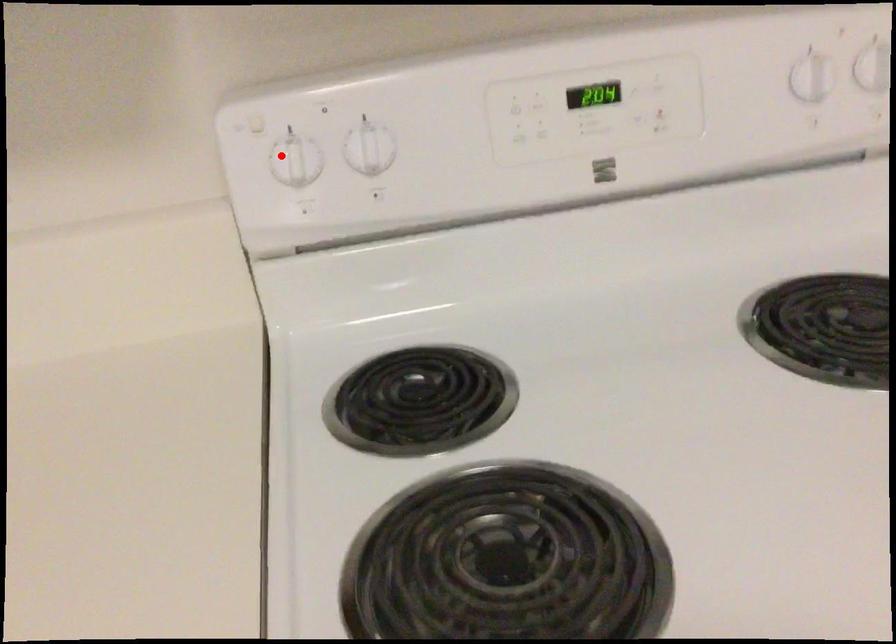
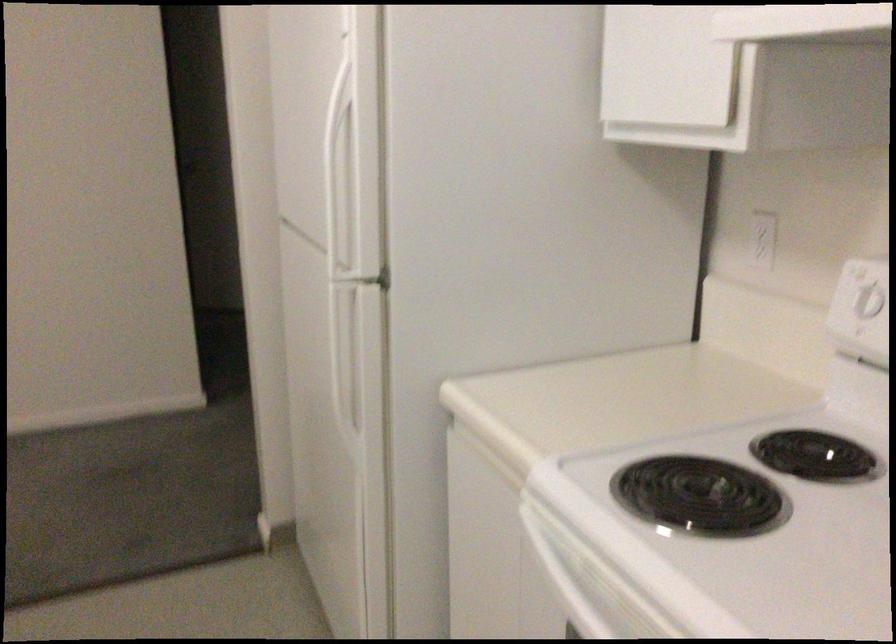
In the second image, find the point that corresponds to the highlighted location in the first image.

(864, 289)